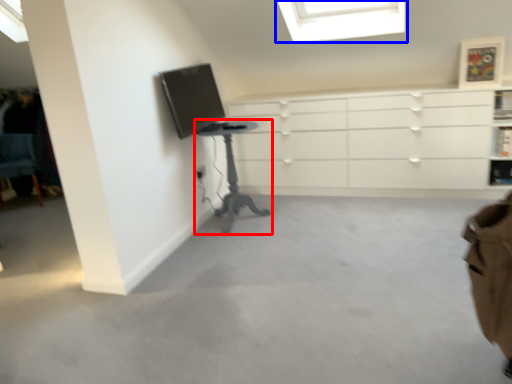
Question: Which of the following is the closest to the observer, table (highlighted by a red box) or window (highlighted by a blue box)?

Choices:
 (A) table
 (B) window

Answer: (A)